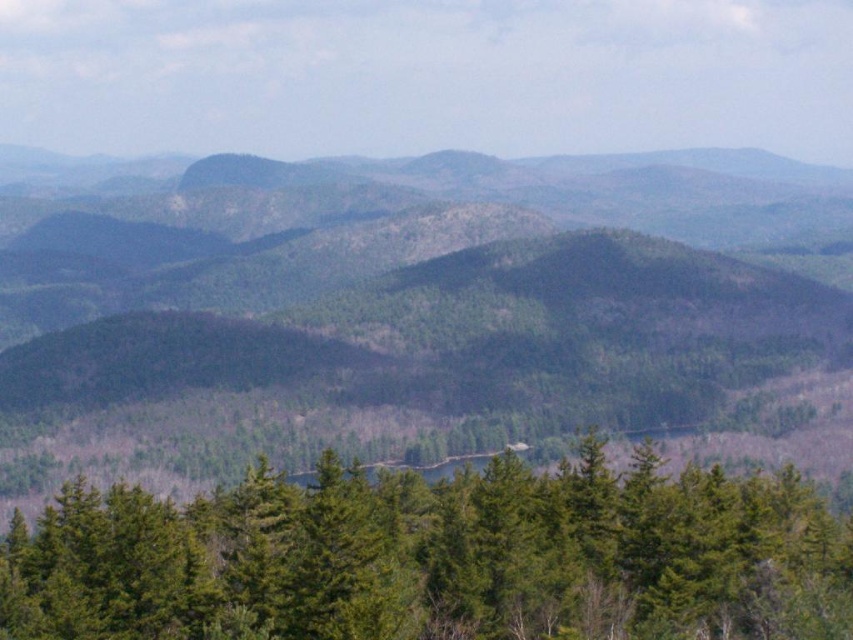
Question: Observing the image, what is the correct spatial positioning of green forested mountain at center in reference to green matte trees at center?

Choices:
 (A) right
 (B) left

Answer: (B)

Question: Is green forested mountain at center wider than green matte trees at center?

Choices:
 (A) no
 (B) yes

Answer: (B)

Question: Which point is farther from the camera taking this photo?

Choices:
 (A) (132, 522)
 (B) (102, 388)

Answer: (B)

Question: Can you confirm if green forested mountain at center is positioned to the right of green matte trees at center?

Choices:
 (A) no
 (B) yes

Answer: (A)

Question: Which of the following is the closest to the observer?

Choices:
 (A) green forested mountain at center
 (B) green matte trees at center

Answer: (B)